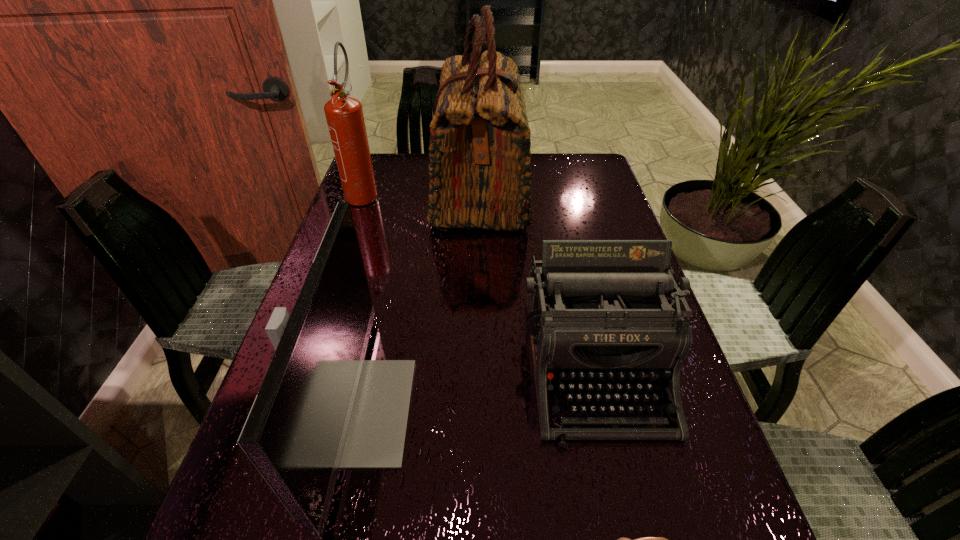
You are a GUI agent. You are given a task and a screenshot of the screen. Output one action in this format:
    pyautogui.click(x=<x>, y=<y>)
    Task: Click on the tallest object
    This screenshot has width=960, height=540.
    Given the screenshot: What is the action you would take?
    pyautogui.click(x=480, y=177)

At what (x,y) coordinates should I click in order to perform the action: click on the fourth shortest object. Please return your answer as a coordinate pair (x, y). The width and height of the screenshot is (960, 540). Looking at the image, I should click on (344, 114).

This screenshot has height=540, width=960. I want to click on the second shortest object, so (x=595, y=318).

This screenshot has height=540, width=960. I want to click on free space located 0.150m on the open handle side of the tallest object, so click(x=381, y=191).

Where is `blank area located on the open handle side of the tallest object`? The height and width of the screenshot is (540, 960). blank area located on the open handle side of the tallest object is located at coordinates (377, 191).

Image resolution: width=960 pixels, height=540 pixels. Find the location of `vacant space located on the open handle side of the tallest object`. vacant space located on the open handle side of the tallest object is located at coordinates (372, 191).

Find the location of a particular element. This screenshot has height=540, width=960. vacant space located 0.260m from the nozzle of the fire extinguisher is located at coordinates (335, 272).

Locate an element on the screen. vacant space situated 0.090m on the keyboard of the typewriter is located at coordinates [628, 504].

Where is `shopping bag present at the far edge`? The width and height of the screenshot is (960, 540). shopping bag present at the far edge is located at coordinates (480, 177).

The width and height of the screenshot is (960, 540). Identify the location of fire extinguisher that is at the far edge. (344, 114).